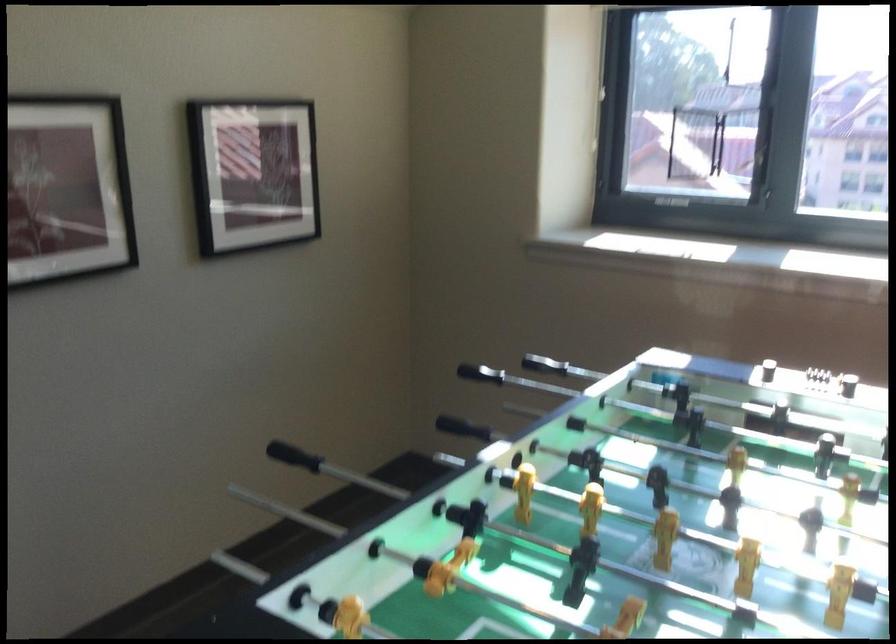
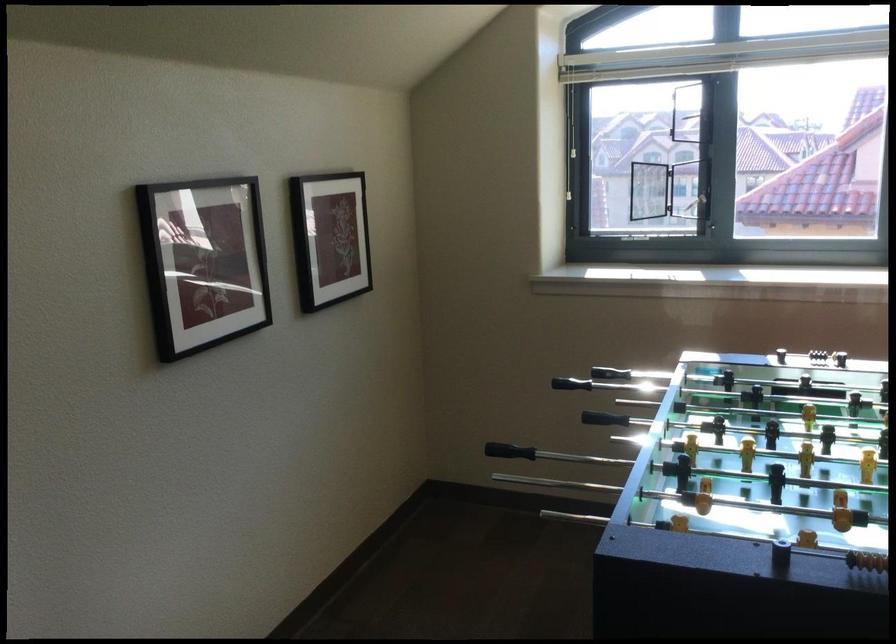
Find the pixel in the second image that matches the point at 596,82 in the first image.

(567, 138)